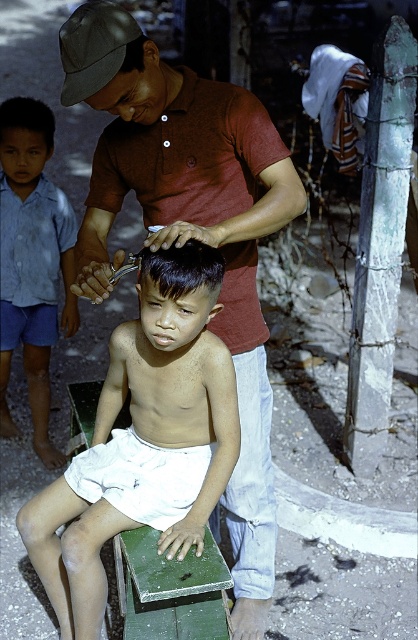
Is smooth skin boy at center below blue cotton shirt at left?

Yes, smooth skin boy at center is below blue cotton shirt at left.

Does smooth skin boy at center have a smaller size compared to blue cotton shirt at left?

Yes.

Who is more distant from viewer, (30, 541) or (20, 104)?

Positioned behind is point (20, 104).

This screenshot has height=640, width=418. Identify the location of smooth skin boy at center. (143, 440).

From the picture: Does matte maroon shirt at center have a lesser width compared to blue cotton shirt at left?

No, matte maroon shirt at center is not thinner than blue cotton shirt at left.

In the scene shown: Does matte maroon shirt at center have a greater width compared to blue cotton shirt at left?

Yes, matte maroon shirt at center is wider than blue cotton shirt at left.

At what (x,y) coordinates should I click in order to perform the action: click on matte maroon shirt at center. Please return your answer as a coordinate pair (x, y). The height and width of the screenshot is (640, 418). Looking at the image, I should click on (191, 230).

Identify the location of matte maroon shirt at center. This screenshot has width=418, height=640. tap(191, 230).

Can you confirm if smooth skin boy at center is smaller than gray fabric baseball cap at upper left?

No.

Between smooth skin boy at center and gray fabric baseball cap at upper left, which one appears on the left side from the viewer's perspective?

gray fabric baseball cap at upper left is more to the left.

The height and width of the screenshot is (640, 418). Describe the element at coordinates (143, 440) in the screenshot. I see `smooth skin boy at center` at that location.

Locate an element on the screen. smooth skin boy at center is located at coordinates (143, 440).